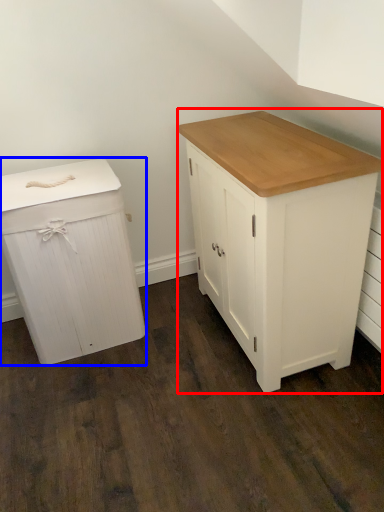
Question: Which object is further to the camera taking this photo, chest of drawers (highlighted by a red box) or chest of drawers (highlighted by a blue box)?

Choices:
 (A) chest of drawers
 (B) chest of drawers

Answer: (B)